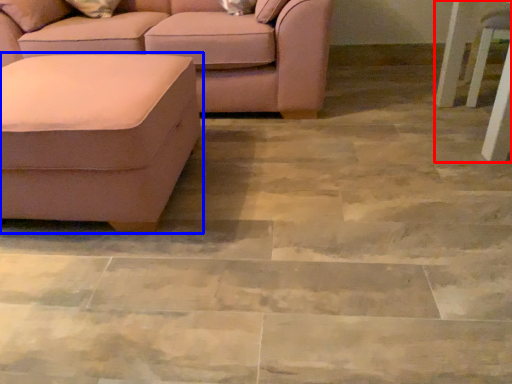
Question: Which of the following is the closest to the observer, side table (highlighted by a red box) or studio couch (highlighted by a blue box)?

Choices:
 (A) side table
 (B) studio couch

Answer: (B)